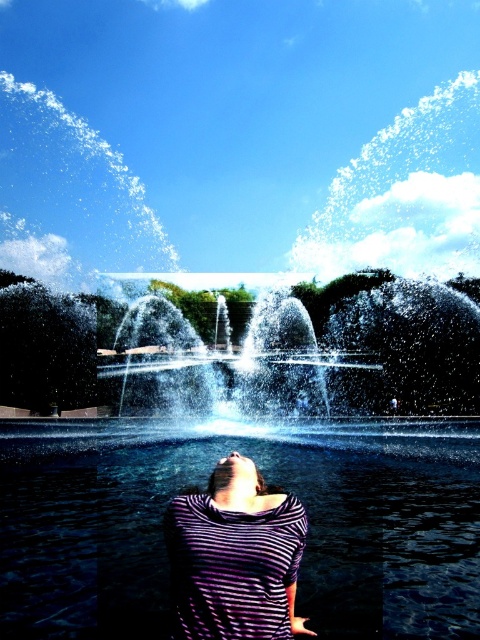
Question: Which object appears farthest from the camera in this image?

Choices:
 (A) purple striped shirt at center
 (B) clear water at center

Answer: (B)

Question: Is clear water at center positioned in front of purple striped shirt at center?

Choices:
 (A) no
 (B) yes

Answer: (A)

Question: Is clear water at center bigger than purple striped shirt at center?

Choices:
 (A) yes
 (B) no

Answer: (A)

Question: Can you confirm if clear water at center is positioned to the left of purple striped shirt at center?

Choices:
 (A) no
 (B) yes

Answer: (B)

Question: Which of the following is the farthest from the observer?

Choices:
 (A) (477, 621)
 (B) (181, 611)

Answer: (A)